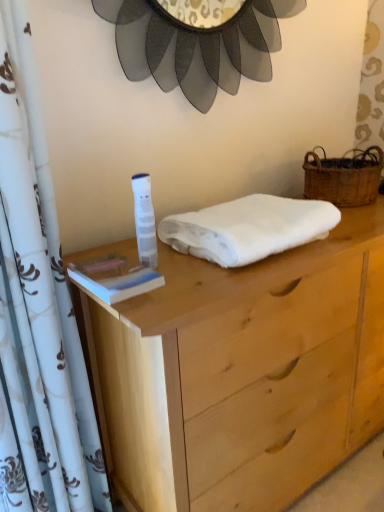
Question: Is white soft towel at center further to camera compared to white floral fabric curtain at left?

Choices:
 (A) yes
 (B) no

Answer: (A)

Question: Is white soft towel at center at the right side of white floral fabric curtain at left?

Choices:
 (A) yes
 (B) no

Answer: (A)

Question: Is white soft towel at center located outside white floral fabric curtain at left?

Choices:
 (A) no
 (B) yes

Answer: (B)

Question: From the image's perspective, is white soft towel at center on white floral fabric curtain at left?

Choices:
 (A) no
 (B) yes

Answer: (B)

Question: Does white soft towel at center have a lesser width compared to white floral fabric curtain at left?

Choices:
 (A) no
 (B) yes

Answer: (A)

Question: From the image's perspective, is white floral fabric curtain at left located above or below white plastic tube at center?

Choices:
 (A) below
 (B) above

Answer: (A)

Question: In terms of width, does white floral fabric curtain at left look wider or thinner when compared to white plastic tube at center?

Choices:
 (A) thin
 (B) wide

Answer: (B)

Question: Is white floral fabric curtain at left bigger or smaller than white plastic tube at center?

Choices:
 (A) big
 (B) small

Answer: (A)

Question: Is white floral fabric curtain at left in front of or behind white plastic tube at center in the image?

Choices:
 (A) behind
 (B) front

Answer: (B)

Question: Considering their positions, is white floral fabric curtain at left located in front of or behind white soft towel at center?

Choices:
 (A) behind
 (B) front

Answer: (B)

Question: From the image's perspective, is white floral fabric curtain at left above or below white soft towel at center?

Choices:
 (A) below
 (B) above

Answer: (A)

Question: From a real-world perspective, is white floral fabric curtain at left positioned above or below white soft towel at center?

Choices:
 (A) above
 (B) below

Answer: (B)

Question: In terms of height, does white floral fabric curtain at left look taller or shorter compared to white soft towel at center?

Choices:
 (A) tall
 (B) short

Answer: (A)

Question: Choose the correct answer: Is brown woven picnic basket at right inside white floral fabric curtain at left or outside it?

Choices:
 (A) outside
 (B) inside

Answer: (A)

Question: Is brown woven picnic basket at right wider or thinner than white floral fabric curtain at left?

Choices:
 (A) thin
 (B) wide

Answer: (B)